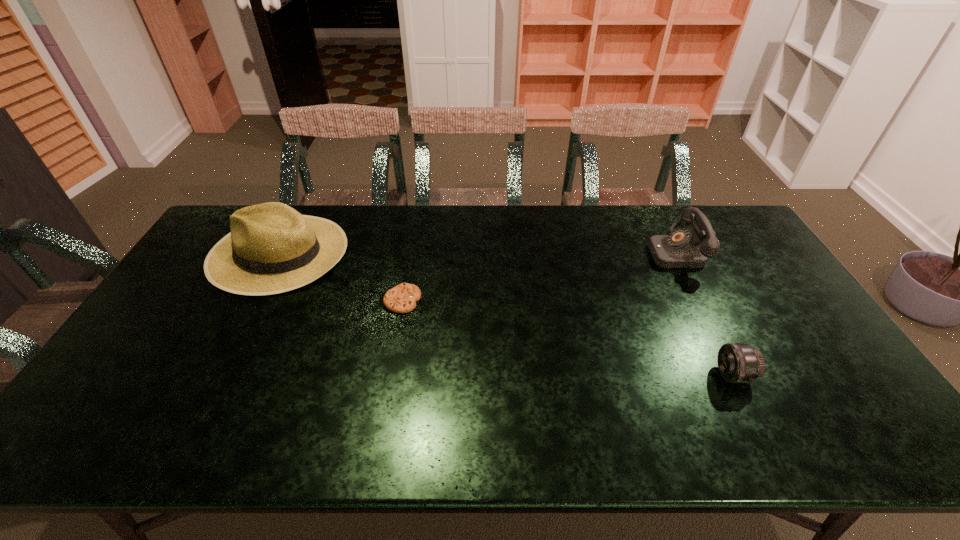
Locate an element on the screen. This screenshot has height=540, width=960. vacant space positioned 0.190m on the front-facing side of the nearest object is located at coordinates (643, 375).

Identify the location of vacant space located 0.230m on the front-facing side of the nearest object. The width and height of the screenshot is (960, 540). (627, 375).

Where is `free spot located on the front-facing side of the nearest object`? This screenshot has height=540, width=960. free spot located on the front-facing side of the nearest object is located at coordinates (643, 375).

At what (x,y) coordinates should I click in order to perform the action: click on free space located 0.370m on the back of the cookie. Please return your answer as a coordinate pair (x, y). The width and height of the screenshot is (960, 540). Looking at the image, I should click on (418, 218).

The height and width of the screenshot is (540, 960). Identify the location of sunhat that is at the far edge. (272, 248).

This screenshot has width=960, height=540. Identify the location of telephone that is at the far edge. (683, 248).

The image size is (960, 540). Identify the location of object at the left edge. (272, 248).

The height and width of the screenshot is (540, 960). I want to click on object that is at the far left corner, so click(x=272, y=248).

The height and width of the screenshot is (540, 960). What are the coordinates of `vacant region at the far edge of the desktop` in the screenshot? It's located at (412, 242).

You are a GUI agent. You are given a task and a screenshot of the screen. Output one action in this format:
    pyautogui.click(x=<x>, y=<y>)
    Task: Click on the vacant space at the near edge of the desktop
    Image resolution: width=960 pixels, height=540 pixels.
    Given the screenshot: What is the action you would take?
    pyautogui.click(x=674, y=442)